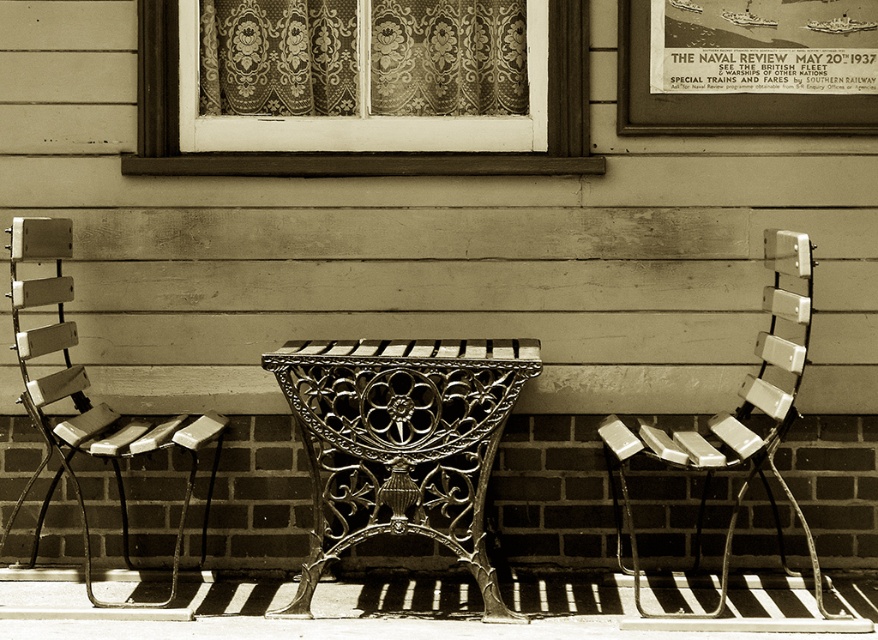
How distant is matte lace curtain at upper center from metallic poster at upper right?

matte lace curtain at upper center is 26.04 inches away from metallic poster at upper right.

Who is positioned more to the right, matte lace curtain at upper center or metallic poster at upper right?

From the viewer's perspective, metallic poster at upper right appears more on the right side.

Where is `matte lace curtain at upper center`? This screenshot has height=640, width=878. matte lace curtain at upper center is located at coordinates (364, 150).

Can you confirm if cast iron bench at center is positioned to the right of metallic silver chair at right?

Incorrect, cast iron bench at center is not on the right side of metallic silver chair at right.

Between cast iron bench at center and metallic silver chair at right, which one has more height?

With more height is metallic silver chair at right.

Between point (471, 518) and point (740, 486), which one is positioned behind?

The point (740, 486) is behind.

Where is `cast iron bench at center`? The height and width of the screenshot is (640, 878). cast iron bench at center is located at coordinates (401, 442).

Which is below, matte wood chair at left or metallic silver chair at right?

Positioned lower is metallic silver chair at right.

Can you confirm if matte wood chair at left is shorter than metallic silver chair at right?

Incorrect, matte wood chair at left's height does not fall short of metallic silver chair at right's.

Measure the distance between point (44, 304) and camera.

18.21 feet

Locate an element on the screen. matte wood chair at left is located at coordinates (83, 394).